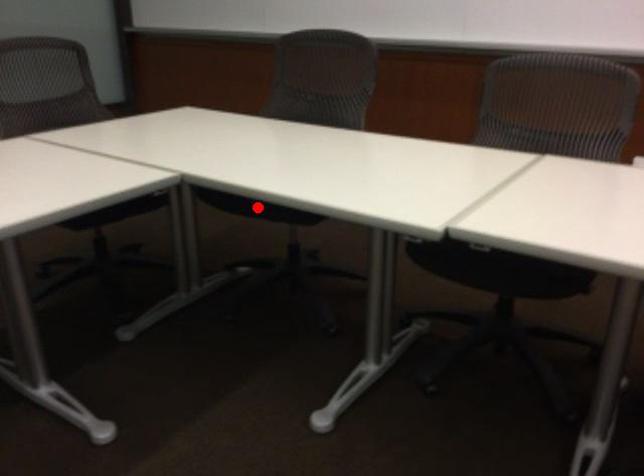
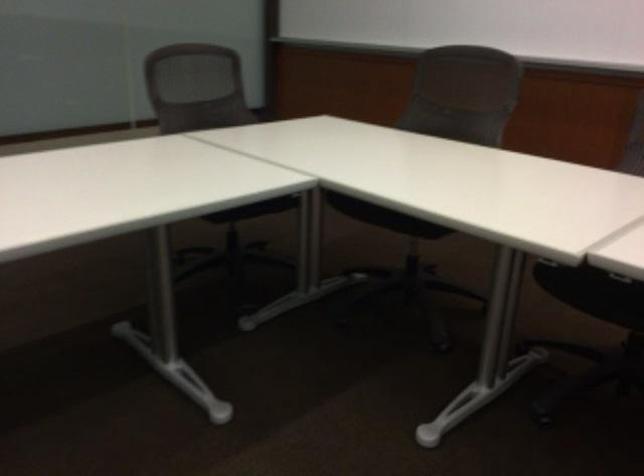
The point at the highlighted location is marked in the first image. Where is the corresponding point in the second image?

(384, 216)